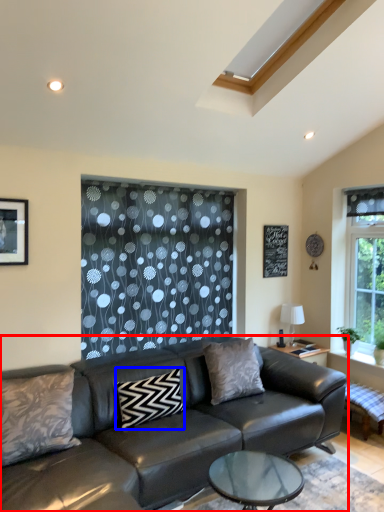
Question: Among these objects, which one is nearest to the camera, studio couch (highlighted by a red box) or pillow (highlighted by a blue box)?

Choices:
 (A) studio couch
 (B) pillow

Answer: (A)